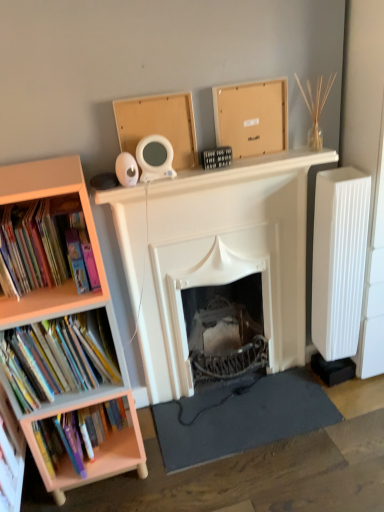
Where is `vacant space in front of white ribbed radiator at right`? The width and height of the screenshot is (384, 512). vacant space in front of white ribbed radiator at right is located at coordinates (348, 402).